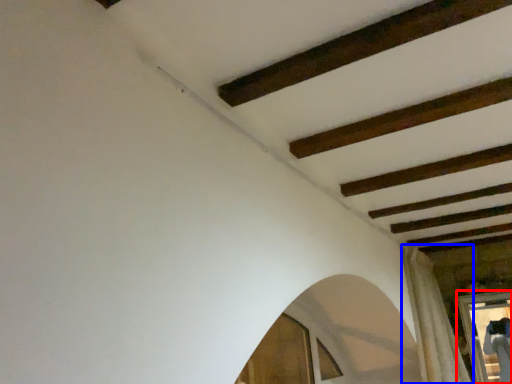
Question: Which object is further to the camera taking this photo, window frame (highlighted by a red box) or curtain (highlighted by a blue box)?

Choices:
 (A) window frame
 (B) curtain

Answer: (A)